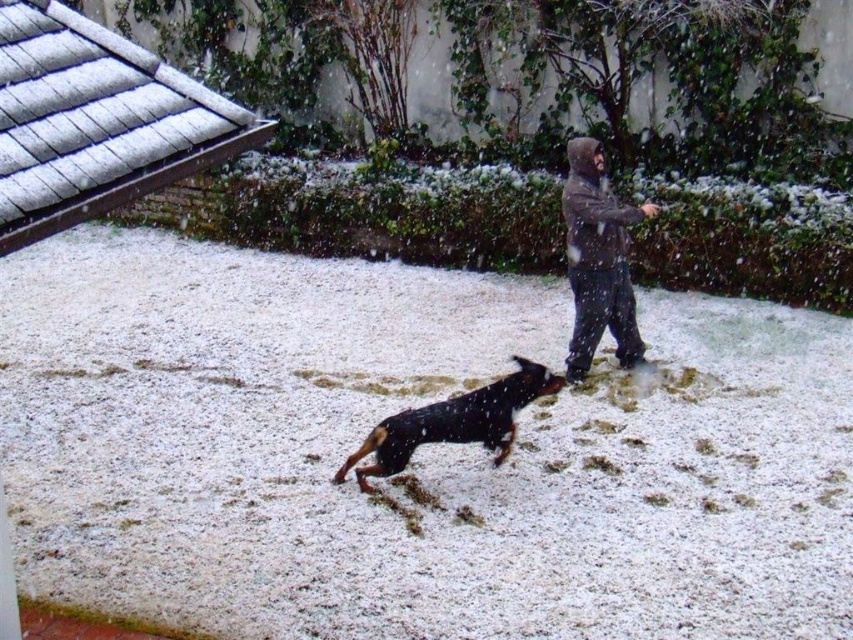
Between white fluffy snow at center and black and tan fur dog at center, which one is positioned higher?

white fluffy snow at center is above.

Does point (606, 465) come closer to viewer compared to point (418, 436)?

No, it is behind (418, 436).

Find the location of a particular element. Image resolution: width=853 pixels, height=640 pixels. white fluffy snow at center is located at coordinates (415, 452).

Does dark gray hoodie at center appear over black and tan fur dog at center?

Indeed, dark gray hoodie at center is positioned over black and tan fur dog at center.

Which is more to the right, dark gray hoodie at center or black and tan fur dog at center?

dark gray hoodie at center is more to the right.

This screenshot has width=853, height=640. I want to click on dark gray hoodie at center, so click(598, 259).

Locate an element on the screen. dark gray hoodie at center is located at coordinates (598, 259).

Does point (355, 412) come behind point (583, 209)?

Yes, point (355, 412) is behind point (583, 209).

Measure the distance from white fluffy snow at center to dark gray hoodie at center.

A distance of 2.12 meters exists between white fluffy snow at center and dark gray hoodie at center.

Does point (317, 476) come farther from viewer compared to point (584, 227)?

No, it is in front of (584, 227).

At what (x,y) coordinates should I click in order to perform the action: click on white fluffy snow at center. Please return your answer as a coordinate pair (x, y). Image resolution: width=853 pixels, height=640 pixels. Looking at the image, I should click on (415, 452).